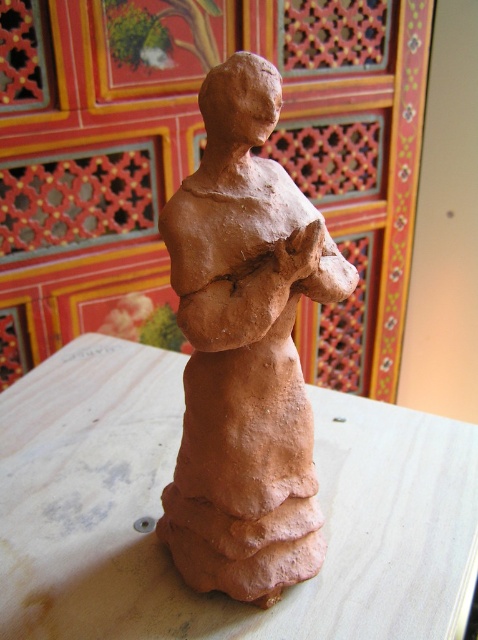
You are placing a small decorative item on the matte wood table at center. The item is 3 inches wide. Will it fit on the table without overlapping the matte clay figure at center?

The matte wood table at center is 12.06 inches away from the matte clay figure at center. Since the item is only 3 inches wide, there is enough space between them to place the item without overlapping.

You are setting up a display in a gallery and need to place both the matte wood table at center and the matte clay figure at center. Given their sizes, which object should you place first to ensure stability?

The matte wood table at center has a larger size compared to the matte clay figure at center, so you should place the matte wood table at center first to establish a stable base before placing the smaller matte clay figure at center on top of it.

You are arranging items on a matte wood table at center. You have a small, handcrafted terracotta figurine and a decorative panel with intricate geometric patterns. How far apart are these two items?

The small, handcrafted terracotta figurine and the decorative panel with intricate geometric patterns are 35.58 inches apart.